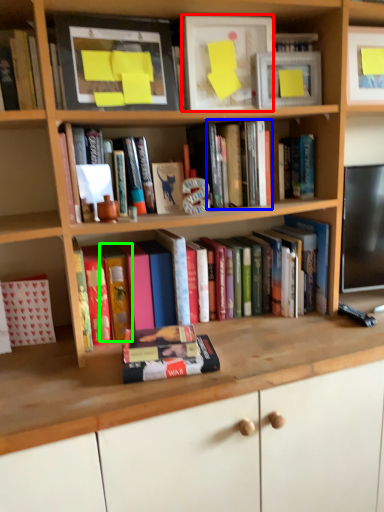
Question: Which object is positioned farthest from paperback book (highlighted by a red box)? Select from book (highlighted by a blue box) and paperback book (highlighted by a green box).

Choices:
 (A) book
 (B) paperback book

Answer: (B)